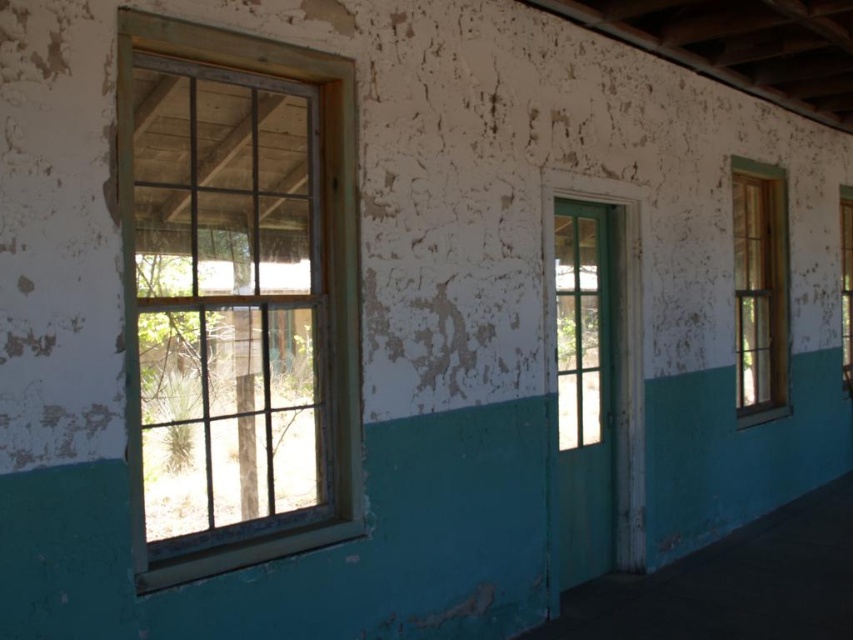
From the picture: Can you confirm if wooden frame window at right is taller than green matte glass door at center?

Indeed, wooden frame window at right has a greater height compared to green matte glass door at center.

Who is higher up, wooden frame window at right or green matte glass door at center?

wooden frame window at right is above.

This screenshot has height=640, width=853. I want to click on wooden frame window at right, so click(759, 289).

I want to click on wooden frame window at right, so click(x=759, y=289).

Is wooden-framed window at center-left shorter than clear glass window at right?

Yes, wooden-framed window at center-left is shorter than clear glass window at right.

How much distance is there between wooden-framed window at center-left and clear glass window at right?

wooden-framed window at center-left is 7.29 meters away from clear glass window at right.

You are a GUI agent. You are given a task and a screenshot of the screen. Output one action in this format:
    pyautogui.click(x=<x>, y=<y>)
    Task: Click on the wooden-framed window at center-left
    
    Given the screenshot: What is the action you would take?
    pyautogui.click(x=236, y=296)

Measure the distance between wooden frame window at right and clear glass window at right.

wooden frame window at right and clear glass window at right are 6.57 feet apart.

Does wooden frame window at right have a lesser height compared to clear glass window at right?

Correct, wooden frame window at right is not as tall as clear glass window at right.

Is point (769, 403) closer to camera compared to point (846, 371)?

That is True.

You are a GUI agent. You are given a task and a screenshot of the screen. Output one action in this format:
    pyautogui.click(x=<x>, y=<y>)
    Task: Click on the wooden frame window at right
    Image resolution: width=853 pixels, height=640 pixels.
    Given the screenshot: What is the action you would take?
    pyautogui.click(x=759, y=289)